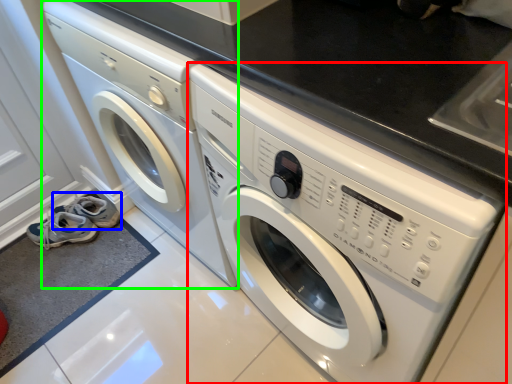
Question: Estimate the real-world distances between objects in this image. Which object is farther from washing machine (highlighted by a red box), shoe (highlighted by a blue box) or washing machine (highlighted by a green box)?

Choices:
 (A) shoe
 (B) washing machine

Answer: (A)